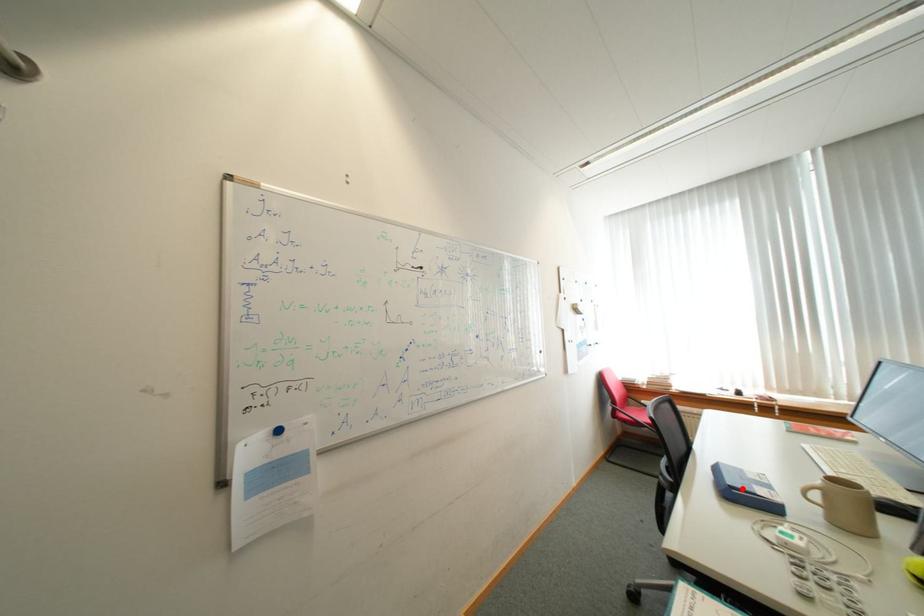
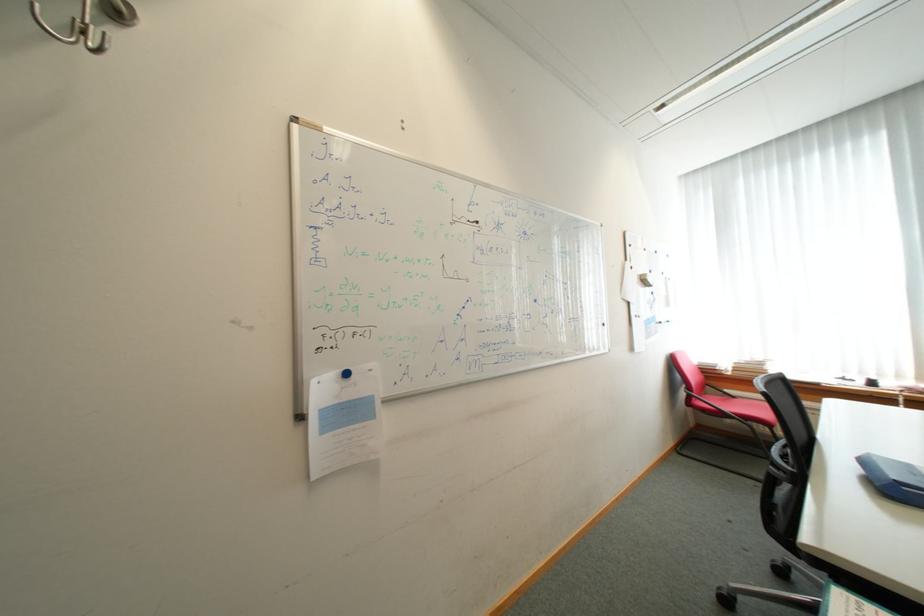
The point at the highlighted location is marked in the first image. Where is the corresponding point in the second image?

(912, 485)